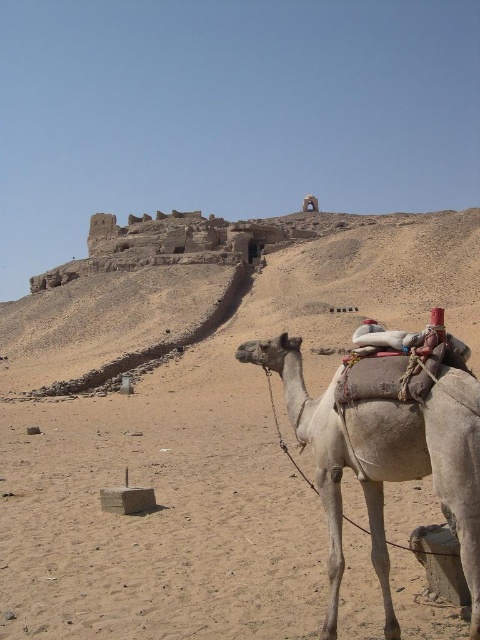
Question: Which point appears farthest from the camera in this image?

Choices:
 (A) (219, 438)
 (B) (372, 408)

Answer: (A)

Question: Does beige sandy desert at center have a lesser width compared to light beige textured camel at lower right?

Choices:
 (A) no
 (B) yes

Answer: (A)

Question: Is beige sandy desert at center positioned at the back of light beige textured camel at lower right?

Choices:
 (A) no
 (B) yes

Answer: (B)

Question: Among these objects, which one is nearest to the camera?

Choices:
 (A) beige sandy desert at center
 (B) light beige textured camel at lower right

Answer: (B)

Question: In this image, where is beige sandy desert at center located relative to light beige textured camel at lower right?

Choices:
 (A) left
 (B) right

Answer: (A)